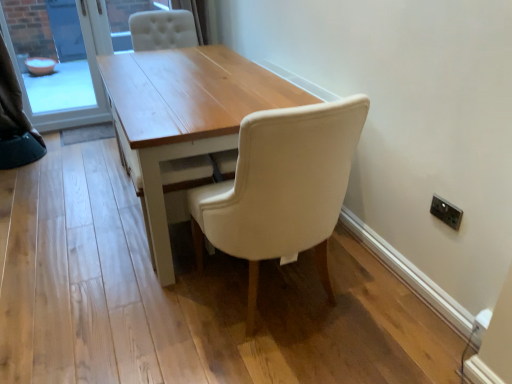
Question: From the image's perspective, is matte glass bowl at left on top of light wood table at center?

Choices:
 (A) yes
 (B) no

Answer: (A)

Question: Does matte glass bowl at left lie behind light wood table at center?

Choices:
 (A) no
 (B) yes

Answer: (B)

Question: Considering the relative sizes of matte glass bowl at left and light wood table at center in the image provided, is matte glass bowl at left wider than light wood table at center?

Choices:
 (A) no
 (B) yes

Answer: (A)

Question: Can you confirm if matte glass bowl at left is thinner than light wood table at center?

Choices:
 (A) yes
 (B) no

Answer: (A)

Question: Does matte glass bowl at left lie in front of light wood table at center?

Choices:
 (A) no
 (B) yes

Answer: (A)

Question: Considering the positions of point (10, 115) and point (222, 119), is point (10, 115) closer or farther from the camera than point (222, 119)?

Choices:
 (A) farther
 (B) closer

Answer: (A)

Question: From the image's perspective, is white fabric curtain at upper left above or below light wood table at center?

Choices:
 (A) below
 (B) above

Answer: (B)

Question: Considering the positions of white fabric curtain at upper left and light wood table at center in the image, is white fabric curtain at upper left taller or shorter than light wood table at center?

Choices:
 (A) tall
 (B) short

Answer: (A)

Question: Based on their positions, is white fabric curtain at upper left located to the left or right of light wood table at center?

Choices:
 (A) left
 (B) right

Answer: (A)

Question: Which is correct: white fabric curtain at upper left is inside matte glass bowl at left, or outside of it?

Choices:
 (A) inside
 (B) outside

Answer: (B)

Question: From the image's perspective, is white fabric curtain at upper left positioned above or below matte glass bowl at left?

Choices:
 (A) below
 (B) above

Answer: (A)

Question: In terms of width, does white fabric curtain at upper left look wider or thinner when compared to matte glass bowl at left?

Choices:
 (A) thin
 (B) wide

Answer: (B)

Question: From a real-world perspective, is white fabric curtain at upper left positioned above or below matte glass bowl at left?

Choices:
 (A) above
 (B) below

Answer: (A)

Question: Considering the positions of matte glass bowl at left and white fabric curtain at upper left in the image, is matte glass bowl at left bigger or smaller than white fabric curtain at upper left?

Choices:
 (A) small
 (B) big

Answer: (B)

Question: Looking at their shapes, would you say matte glass bowl at left is wider or thinner than white fabric curtain at upper left?

Choices:
 (A) thin
 (B) wide

Answer: (A)